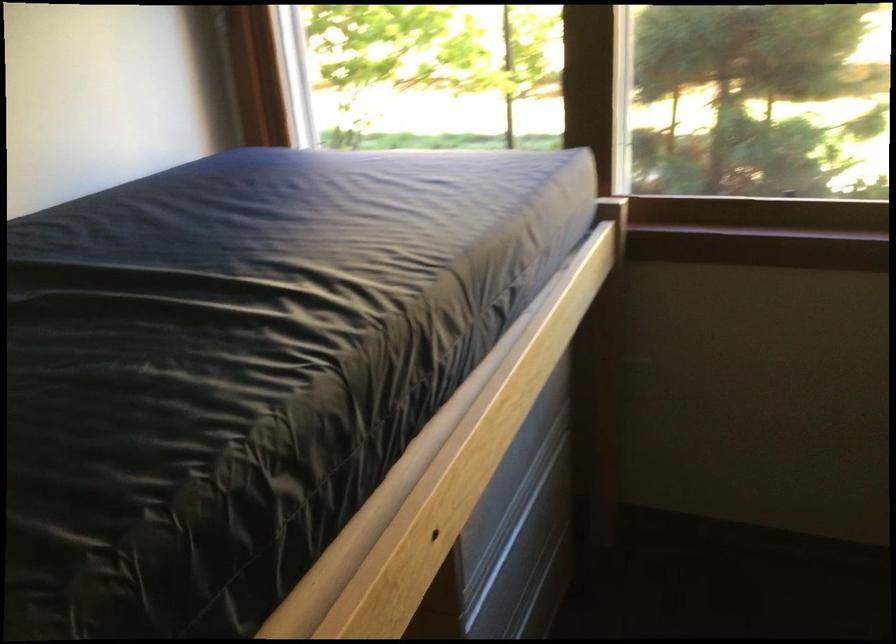
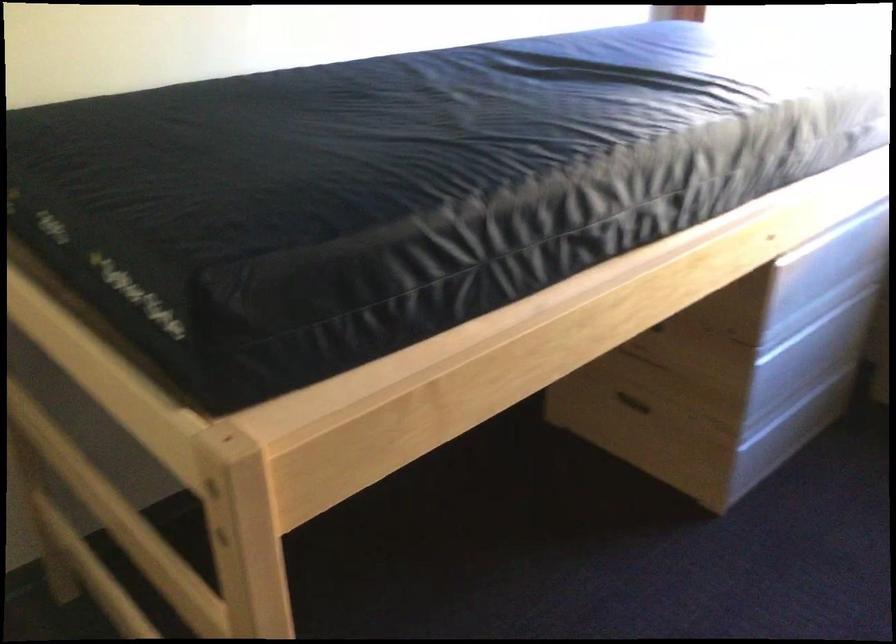
Question: Based on the continuous images, in which direction is the camera rotating? Reply with the corresponding letter.

Choices:
 (A) Left
 (B) Right
 (C) Up
 (D) Down

Answer: (A)